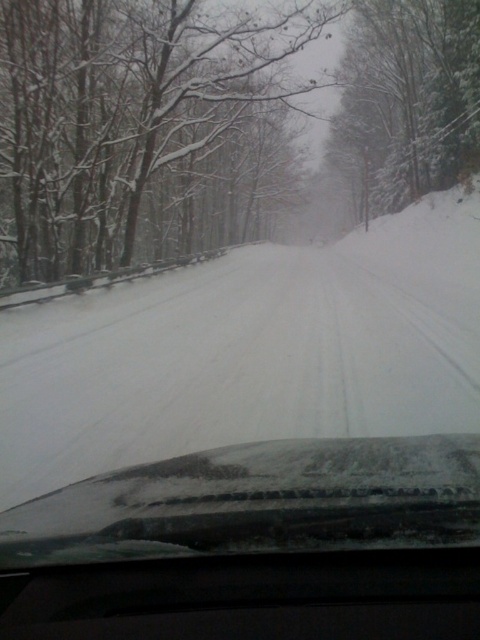
You are driving and want to check if there is enough space between the snowy bark tree at center and the snowy glass windshield at center to safely pass through. Can you determine if there is enough space based on their positions?

The snowy bark tree at center is to the right of snowy glass windshield at center, so there is space between them to safely pass through.

You are a passenger in a car driving on a snowy road. You notice the snowy bark tree at center and the snowy glass windshield at center. Which object is positioned higher from your viewpoint inside the car?

The snowy bark tree at center is above the snowy glass windshield at center, so the snowy bark tree at center is positioned higher from your viewpoint inside the car.

You are driving a car with a 10 meter long trailer attached to it. You want to make sure you can safely stop before reaching the point at coordinates point (15, 148). What is the minimum distance you need to start braking from to ensure you stop before reaching that point?

The point at coordinates point (15, 148) is 17.97 meters away from the viewer. To safely stop before reaching it with a trailer, you need to start braking at least 17.97 meters before that point, considering the total stopping distance required for the vehicle and trailer combination.